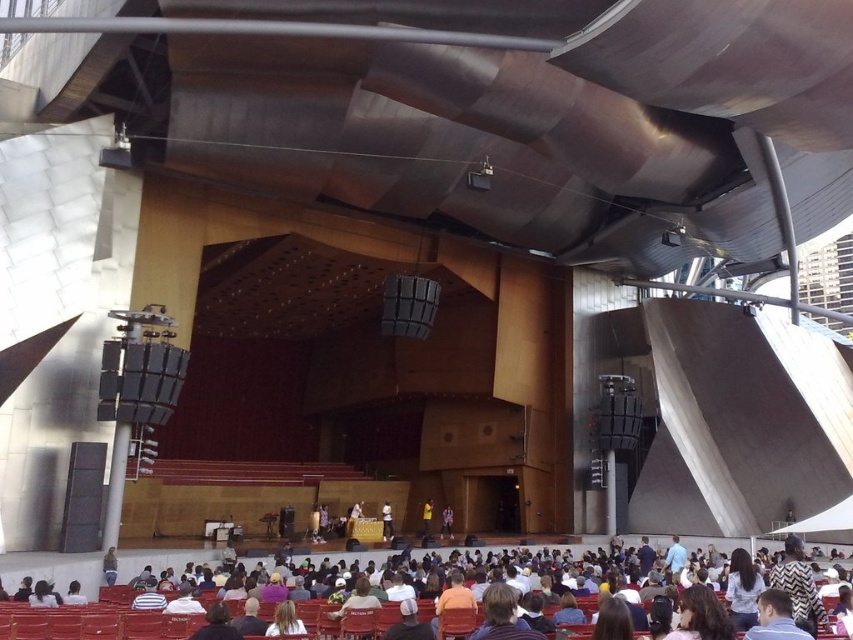
Locate an element on the screen. This screenshot has width=853, height=640. white fabric shirt at center is located at coordinates (386, 520).

Who is higher up, white fabric shirt at center or dark blue shirt at center?

white fabric shirt at center is above.

The height and width of the screenshot is (640, 853). Find the location of `white fabric shirt at center`. white fabric shirt at center is located at coordinates (386, 520).

Does yellow fabric at stage center appear on the left side of dark blue shirt at center?

Indeed, yellow fabric at stage center is positioned on the left side of dark blue shirt at center.

Which is below, yellow fabric at stage center or dark blue shirt at center?

→ Positioned lower is dark blue shirt at center.

Which is in front, point (431, 516) or point (445, 532)?

Point (445, 532) is more forward.

Where is `yellow fabric at stage center`? The width and height of the screenshot is (853, 640). yellow fabric at stage center is located at coordinates (426, 518).

Between white fabric shirt at center and yellow fabric at stage center, which one is positioned lower?

yellow fabric at stage center is below.

Between white fabric shirt at center and yellow fabric at stage center, which one appears on the right side from the viewer's perspective?

yellow fabric at stage center

I want to click on white fabric shirt at center, so click(386, 520).

Image resolution: width=853 pixels, height=640 pixels. Identify the location of white fabric shirt at center. (386, 520).